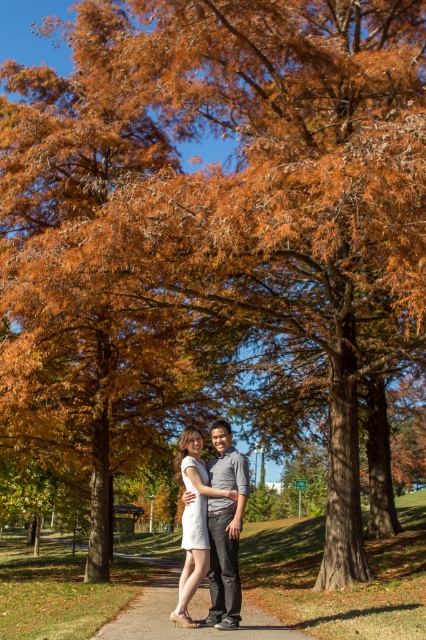
You are a photographer positioned to the side of the scene. You want to capture a photo where the brown gravel path at center and the gray cotton shirt at center are both visible. Based on their positions, which object will appear lower in the photo?

The brown gravel path at center is located below the gray cotton shirt at center, so in the photo, the brown gravel path at center will appear lower than the gray cotton shirt at center.

You are a hiker who wants to take a photo of the brown gravel path at center. Where should you position yourself to capture the entire path in the frame?

The brown gravel path at center is located at point (172, 608), so you should position yourself at a central viewpoint to ensure the entire path is visible in the frame.